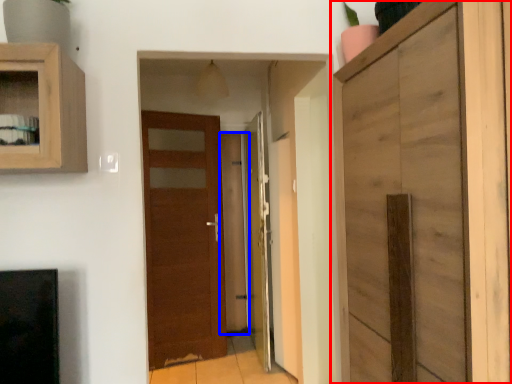
Question: Which of the following is the closest to the observer, cupboard (highlighted by a red box) or glass door (highlighted by a blue box)?

Choices:
 (A) cupboard
 (B) glass door

Answer: (A)